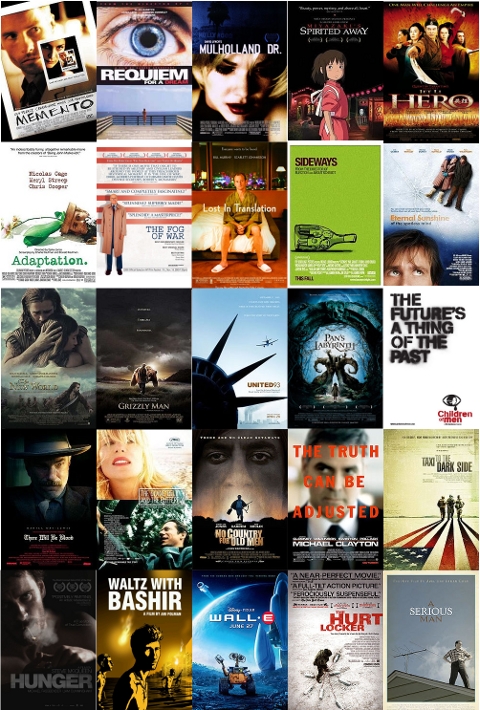
Locate an element on the screen. dvds in the bottom two rows is located at coordinates (438, 630), (423, 500), (335, 491), (336, 626), (248, 615), (232, 503), (159, 503), (150, 611), (61, 635), (53, 503).